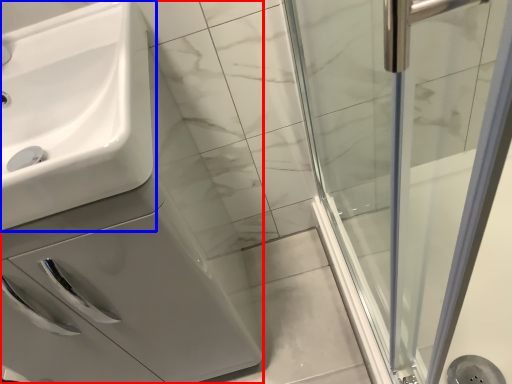
Question: Which object is further to the camera taking this photo, porcelain (highlighted by a red box) or sink (highlighted by a blue box)?

Choices:
 (A) porcelain
 (B) sink

Answer: (A)